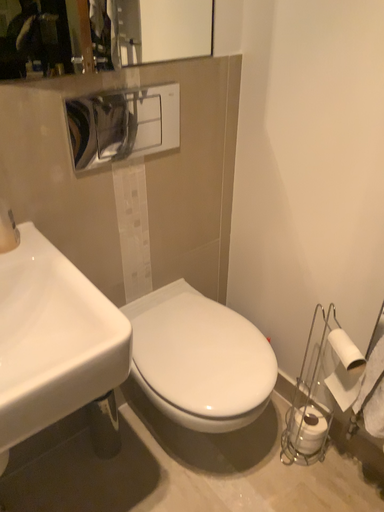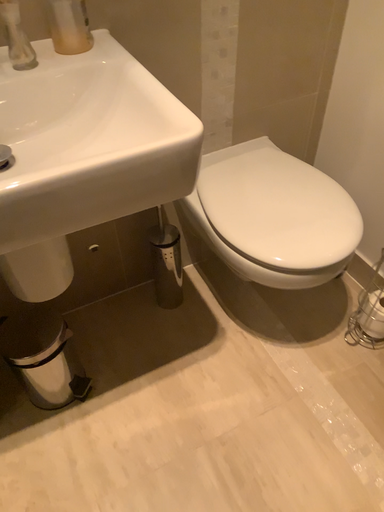
Question: How did the camera likely rotate when shooting the video?

Choices:
 (A) rotated right
 (B) rotated left

Answer: (B)